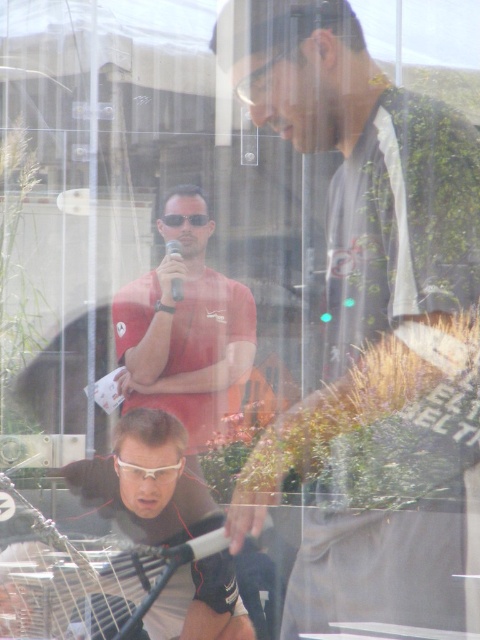
Question: Does matte red shirt at center have a lesser width compared to matte black goggles at center?

Choices:
 (A) no
 (B) yes

Answer: (A)

Question: Estimate the real-world distances between objects in this image. Which object is closer to the white plastic goggles at lower center?

Choices:
 (A) matte red shirt at center
 (B) matte black goggles at center

Answer: (A)

Question: Which object is the farthest from the matte red shirt at center?

Choices:
 (A) white plastic goggles at lower center
 (B) matte black goggles at center

Answer: (A)

Question: In this image, where is white plastic goggles at lower center located relative to matte black goggles at center?

Choices:
 (A) left
 (B) right

Answer: (A)

Question: Can you confirm if matte red shirt at center is smaller than white plastic goggles at lower center?

Choices:
 (A) no
 (B) yes

Answer: (A)

Question: Which point is closer to the camera?

Choices:
 (A) (173, 220)
 (B) (123, 465)
 (C) (165, 301)

Answer: (A)